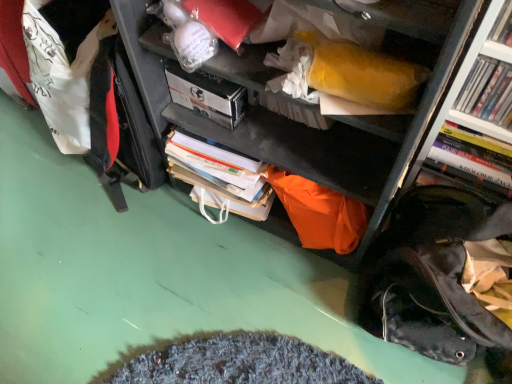
Question: Does hardcover book at right, acting as the 1th book starting from the back, have a lesser width compared to white matte paperback book at upper center?

Choices:
 (A) no
 (B) yes

Answer: (B)

Question: From a real-world perspective, is hardcover book at right, the third book positioned from the front, over white matte paperback book at upper center?

Choices:
 (A) yes
 (B) no

Answer: (B)

Question: Are hardcover book at right, acting as the 1th book starting from the back, and white matte paperback book at upper center located far from each other?

Choices:
 (A) yes
 (B) no

Answer: (B)

Question: Is hardcover book at right, acting as the 1th book starting from the back, further to the viewer compared to white matte paperback book at upper center?

Choices:
 (A) no
 (B) yes

Answer: (A)

Question: From the image's perspective, would you say hardcover book at right, acting as the 1th book starting from the back, is positioned over white matte paperback book at upper center?

Choices:
 (A) yes
 (B) no

Answer: (B)

Question: Is hardcover book at right, the third book positioned from the front, in front of or behind hardcover book at upper right, positioned as the first book in front-to-back order, in the image?

Choices:
 (A) front
 (B) behind

Answer: (B)

Question: Is hardcover book at right, the third book positioned from the front, inside the boundaries of hardcover book at upper right, positioned as the first book in front-to-back order, or outside?

Choices:
 (A) inside
 (B) outside

Answer: (B)

Question: Is point (505, 182) positioned closer to the camera than point (503, 41)?

Choices:
 (A) farther
 (B) closer

Answer: (A)

Question: Looking at their shapes, would you say hardcover book at right, acting as the 1th book starting from the back, is wider or thinner than hardcover book at upper right, positioned as the first book in front-to-back order?

Choices:
 (A) wide
 (B) thin

Answer: (A)

Question: Is white glossy book at upper right, placed as the 2th book when sorted from front to back, inside the boundaries of white matte paperback book at upper center, or outside?

Choices:
 (A) inside
 (B) outside

Answer: (B)

Question: From the image's perspective, is white glossy book at upper right, which appears as the 2th book when viewed from the back, above or below white matte paperback book at upper center?

Choices:
 (A) below
 (B) above

Answer: (A)

Question: Is white glossy book at upper right, which appears as the 2th book when viewed from the back, taller or shorter than white matte paperback book at upper center?

Choices:
 (A) short
 (B) tall

Answer: (B)

Question: From a real-world perspective, is white glossy book at upper right, placed as the 2th book when sorted from front to back, positioned above or below white matte paperback book at upper center?

Choices:
 (A) below
 (B) above

Answer: (B)

Question: From the image's perspective, relative to white glossy book at upper right, placed as the 2th book when sorted from front to back, is hardcover book at upper right, positioned as the first book in front-to-back order, above or below?

Choices:
 (A) above
 (B) below

Answer: (A)

Question: Is point (501, 41) positioned closer to the camera than point (486, 76)?

Choices:
 (A) closer
 (B) farther

Answer: (A)